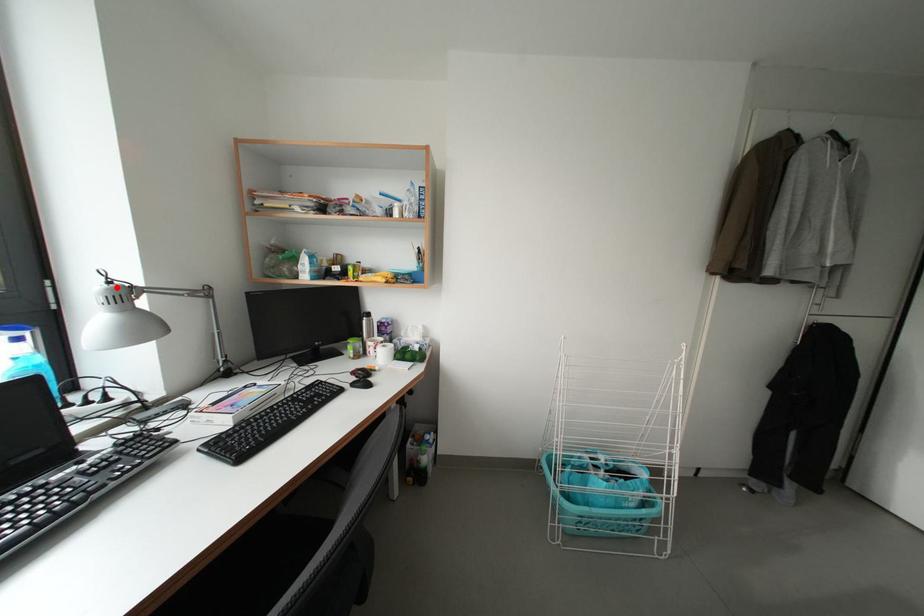
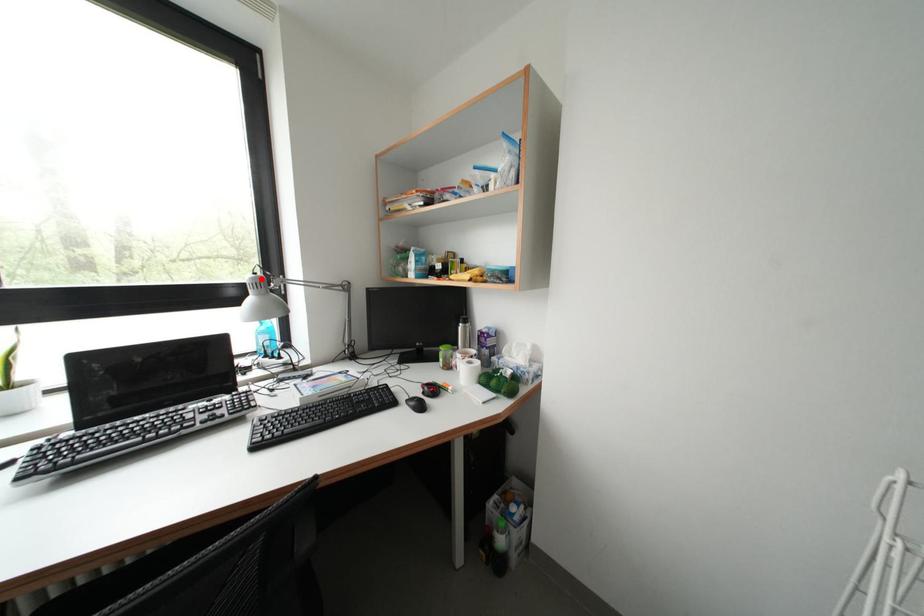
I am providing you with two images of the same scene from different viewpoints. A red point is marked on the first image and another point is marked on the second image. Is the marked point in image1 the same physical position as the marked point in image2?

Yes